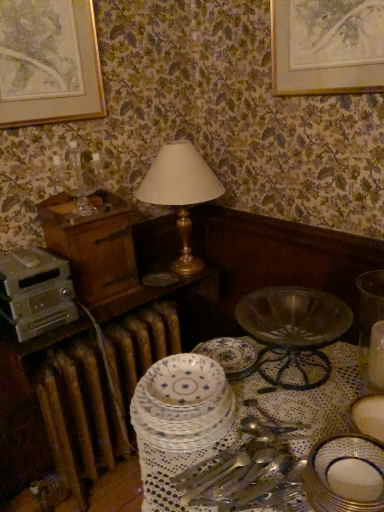
Question: From the image's perspective, is porcelain plate at lower right, the first plate in the right-to-left sequence, over metallic silver appliance at left?

Choices:
 (A) no
 (B) yes

Answer: (A)

Question: Does porcelain plate at lower right, the first plate in the right-to-left sequence, lie in front of metallic silver appliance at left?

Choices:
 (A) yes
 (B) no

Answer: (A)

Question: Is porcelain plate at lower right, marked as the first plate in a front-to-back arrangement, smaller than metallic silver appliance at left?

Choices:
 (A) yes
 (B) no

Answer: (A)

Question: Is porcelain plate at lower right, which is counted as the third plate, starting from the left, to the left of metallic silver appliance at left from the viewer's perspective?

Choices:
 (A) no
 (B) yes

Answer: (A)

Question: From a real-world perspective, is porcelain plate at lower right, marked as the first plate in a front-to-back arrangement, under metallic silver appliance at left?

Choices:
 (A) yes
 (B) no

Answer: (A)

Question: Relative to translucent glass bowl at lower right, is porcelain plate at center, which appears as the 3th plate when viewed from the right, in front or behind?

Choices:
 (A) front
 (B) behind

Answer: (A)

Question: Is porcelain plate at center, the 1th plate positioned from the left, taller or shorter than translucent glass bowl at lower right?

Choices:
 (A) tall
 (B) short

Answer: (B)

Question: From the image's perspective, relative to translucent glass bowl at lower right, is porcelain plate at center, the 1th plate positioned from the left, above or below?

Choices:
 (A) above
 (B) below

Answer: (B)

Question: From a real-world perspective, relative to translucent glass bowl at lower right, is porcelain plate at center, the 1th plate positioned from the left, vertically above or below?

Choices:
 (A) above
 (B) below

Answer: (B)

Question: Is gold-framed artwork at upper left in front of or behind gold metallic table lamp at center in the image?

Choices:
 (A) behind
 (B) front

Answer: (B)

Question: In the image, is gold-framed artwork at upper left on the left side or the right side of gold metallic table lamp at center?

Choices:
 (A) left
 (B) right

Answer: (A)

Question: Choose the correct answer: Is gold-framed artwork at upper left inside gold metallic table lamp at center or outside it?

Choices:
 (A) outside
 (B) inside

Answer: (A)

Question: Considering the positions of gold-framed artwork at upper left and gold metallic table lamp at center in the image, is gold-framed artwork at upper left wider or thinner than gold metallic table lamp at center?

Choices:
 (A) wide
 (B) thin

Answer: (B)

Question: Is metallic silver appliance at left inside or outside of clear glass candle holder at upper left?

Choices:
 (A) outside
 (B) inside

Answer: (A)

Question: Is point (23, 289) closer or farther from the camera than point (54, 164)?

Choices:
 (A) closer
 (B) farther

Answer: (A)